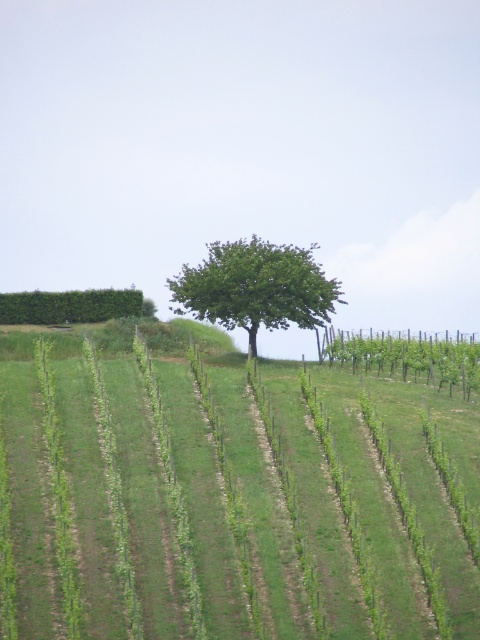
From the picture: You are a drone operator tasked with capturing aerial footage of the vineyard. You need to ensure that both the green grassy field at center and the green leafy tree at center are clearly visible in your shot. Which object should you focus on to ensure the wider area is captured?

The green grassy field at center has a larger width than the green leafy tree at center, so focusing on the green grassy field at center will ensure the wider area is captured.

You are a gardener planning to plant a new row of grapevines in the vineyard. The green grassy field at center and the green leafy tree at center are both in your path. Which area should you choose to plant the new row to maximize space efficiency?

The green grassy field at center has a larger size compared to the green leafy tree at center, so you should plant the new row of grapevines in the green grassy field at center to maximize space efficiency.

You are a gardener planning to plant a new row of grapevines in the green grassy field at center. However, there is a green leafy tree at center in the way. Based on their positions, can you determine if the tree will cast shade over the new grapevines during the afternoon?

The green grassy field at center is positioned under the green leafy tree at center, so the tree will cast shade over the new grapevines planted there during the afternoon.